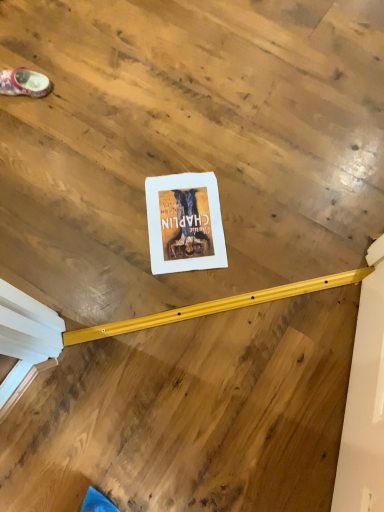
The width and height of the screenshot is (384, 512). I want to click on free location in front of white paper at center, so click(187, 306).